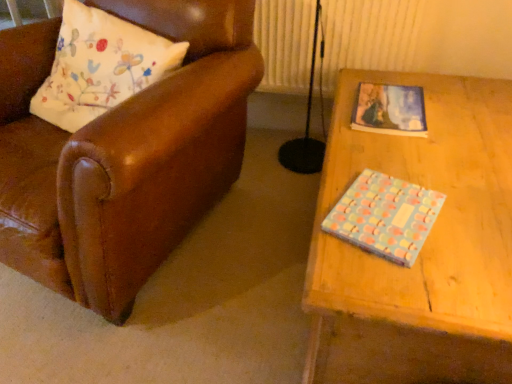
What is the approximate width of leather pillow at left?

It is 11.82 inches.

Where is `pastel polka dot book at right, positioned as the first book in front-to-back order`? The image size is (512, 384). pastel polka dot book at right, positioned as the first book in front-to-back order is located at coordinates (385, 216).

Locate an element on the screen. This screenshot has width=512, height=384. book in front of the leather pillow at left is located at coordinates (385, 216).

Is pastel polka dot book at right, the first book positioned from the bottom, turned away from leather pillow at left?

No, pastel polka dot book at right, the first book positioned from the bottom, is not facing the opposite direction of leather pillow at left.

Considering the relative positions of pastel polka dot book at right, which is the second book from top to bottom, and leather pillow at left in the image provided, is pastel polka dot book at right, which is the second book from top to bottom, to the right of leather pillow at left from the viewer's perspective?

Indeed, pastel polka dot book at right, which is the second book from top to bottom, is positioned on the right side of leather pillow at left.

Is pastel polka dot book at right, the second book from the back, completely or partially inside leather pillow at left?

No.

Which of these two, leather pillow at left or pastel polka dot book at right, the second book from the back, stands shorter?

pastel polka dot book at right, the second book from the back.

Does leather pillow at left have a lesser width compared to pastel polka dot book at right, the second book from the back?

No, leather pillow at left is not thinner than pastel polka dot book at right, the second book from the back.

Can you confirm if leather pillow at left is bigger than pastel polka dot book at right, the second book from the back?

Yes.

From a real-world perspective, is pastel polka dot book at right, which is the second book from top to bottom, under pastel-patterned paper at upper right, which is counted as the 1th book, starting from the top?

Actually, pastel polka dot book at right, which is the second book from top to bottom, is physically above pastel-patterned paper at upper right, which is counted as the 1th book, starting from the top, in the real world.

Identify the location of book directly beneath the pastel polka dot book at right, positioned as the first book in front-to-back order (from a real-world perspective). This screenshot has height=384, width=512. (390, 110).

Is pastel polka dot book at right, the second book from the back, oriented towards pastel-patterned paper at upper right, the 2th book in the front-to-back sequence?

No, pastel polka dot book at right, the second book from the back, does not turn towards pastel-patterned paper at upper right, the 2th book in the front-to-back sequence.

Is leather pillow at left inside pastel-patterned paper at upper right, which is the second book from bottom to top?

No, pastel-patterned paper at upper right, which is the second book from bottom to top, does not contain leather pillow at left.

How many degrees apart are the facing directions of pastel-patterned paper at upper right, arranged as the 1th book when viewed from the back, and leather pillow at left?

The angular difference between pastel-patterned paper at upper right, arranged as the 1th book when viewed from the back, and leather pillow at left is 72 degrees.

Looking at their sizes, would you say pastel-patterned paper at upper right, which is the second book from bottom to top, is wider or thinner than leather pillow at left?

Considering their sizes, pastel-patterned paper at upper right, which is the second book from bottom to top, looks slimmer than leather pillow at left.

Which object is thinner, pastel-patterned paper at upper right, arranged as the 1th book when viewed from the back, or pastel polka dot book at right, positioned as the first book in front-to-back order?

Thinner between the two is pastel polka dot book at right, positioned as the first book in front-to-back order.

Considering the sizes of pastel-patterned paper at upper right, the 2th book in the front-to-back sequence, and pastel polka dot book at right, the first book positioned from the bottom, in the image, is pastel-patterned paper at upper right, the 2th book in the front-to-back sequence, taller or shorter than pastel polka dot book at right, the first book positioned from the bottom,?

Clearly, pastel-patterned paper at upper right, the 2th book in the front-to-back sequence, is shorter compared to pastel polka dot book at right, the first book positioned from the bottom.

Relative to pastel polka dot book at right, the first book positioned from the bottom, is pastel-patterned paper at upper right, which is counted as the 1th book, starting from the top, in front or behind?

pastel-patterned paper at upper right, which is counted as the 1th book, starting from the top, is behind pastel polka dot book at right, the first book positioned from the bottom.

Would you consider pastel-patterned paper at upper right, which is the second book from bottom to top, to be distant from pastel polka dot book at right, the first book positioned from the bottom?

pastel-patterned paper at upper right, which is the second book from bottom to top, is near pastel polka dot book at right, the first book positioned from the bottom, not far away.

Does leather pillow at left have a larger size compared to pastel-patterned paper at upper right, the 2th book in the front-to-back sequence?

Correct, leather pillow at left is larger in size than pastel-patterned paper at upper right, the 2th book in the front-to-back sequence.

Which is correct: leather pillow at left is inside pastel-patterned paper at upper right, arranged as the 1th book when viewed from the back, or outside of it?

leather pillow at left is spatially situated outside pastel-patterned paper at upper right, arranged as the 1th book when viewed from the back.

Is leather pillow at left thinner than pastel-patterned paper at upper right, arranged as the 1th book when viewed from the back?

No.

How distant is leather pillow at left from pastel-patterned paper at upper right, which is counted as the 1th book, starting from the top?

leather pillow at left is 78.27 centimeters away from pastel-patterned paper at upper right, which is counted as the 1th book, starting from the top.

Where is `pillow located behind the pastel polka dot book at right, the first book positioned from the bottom`? The height and width of the screenshot is (384, 512). pillow located behind the pastel polka dot book at right, the first book positioned from the bottom is located at coordinates (100, 66).

Image resolution: width=512 pixels, height=384 pixels. I want to click on book in front of the leather pillow at left, so click(x=385, y=216).

When comparing their distances from pastel-patterned paper at upper right, arranged as the 1th book when viewed from the back, does leather pillow at left or pastel polka dot book at right, the second book from the back, seem closer?

pastel polka dot book at right, the second book from the back, is closer to pastel-patterned paper at upper right, arranged as the 1th book when viewed from the back.

Estimate the real-world distances between objects in this image. Which object is further from leather pillow at left, pastel-patterned paper at upper right, which is the second book from bottom to top, or pastel polka dot book at right, the first book positioned from the bottom?

Based on the image, pastel polka dot book at right, the first book positioned from the bottom, appears to be further to leather pillow at left.

Looking at the image, which one is located closer to leather pillow at left, pastel polka dot book at right, which is the second book from top to bottom, or pastel-patterned paper at upper right, arranged as the 1th book when viewed from the back?

pastel-patterned paper at upper right, arranged as the 1th book when viewed from the back, is closer to leather pillow at left.

Consider the image. Considering their positions, is pastel polka dot book at right, positioned as the first book in front-to-back order, positioned closer to pastel-patterned paper at upper right, arranged as the 1th book when viewed from the back, than leather pillow at left?

pastel polka dot book at right, positioned as the first book in front-to-back order, lies closer to pastel-patterned paper at upper right, arranged as the 1th book when viewed from the back, than the other object.

From the image, which object appears to be nearer to pastel polka dot book at right, the second book from the back, leather pillow at left or pastel-patterned paper at upper right, which is the second book from bottom to top?

Based on the image, pastel-patterned paper at upper right, which is the second book from bottom to top, appears to be nearer to pastel polka dot book at right, the second book from the back.

Looking at the image, which one is located closer to pastel polka dot book at right, the first book positioned from the bottom, pastel-patterned paper at upper right, which is the second book from bottom to top, or leather pillow at left?

pastel-patterned paper at upper right, which is the second book from bottom to top, is closer to pastel polka dot book at right, the first book positioned from the bottom.

You are a GUI agent. You are given a task and a screenshot of the screen. Output one action in this format:
    pyautogui.click(x=<x>, y=<y>)
    Task: Click on the book situated between leather pillow at left and pastel-patterned paper at upper right, arranged as the 1th book when viewed from the back, from left to right
    This screenshot has width=512, height=384.
    Given the screenshot: What is the action you would take?
    pyautogui.click(x=385, y=216)